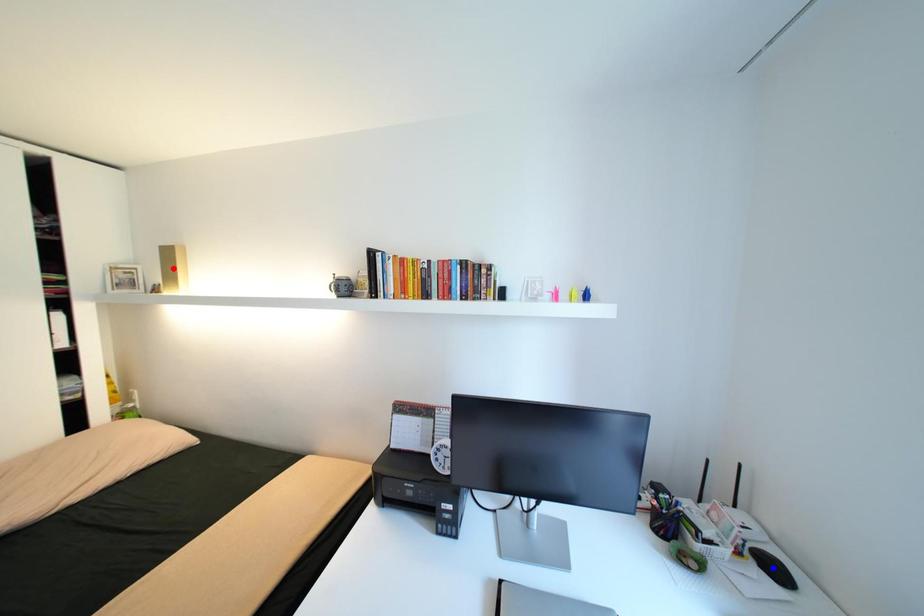
Question: Which of the two points in the image is closer to the camera?

Choices:
 (A) Blue point is closer.
 (B) Red point is closer.

Answer: (A)